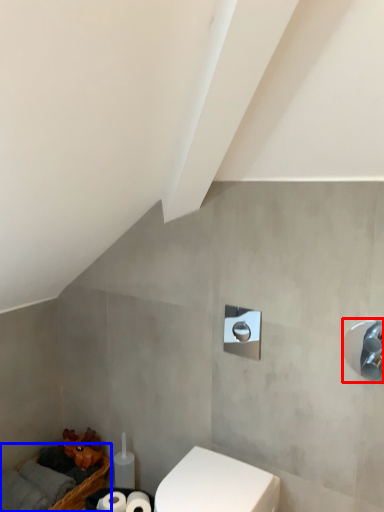
Question: Which point is closer to the camera, shower (highlighted by a red box) or basket (highlighted by a blue box)?

Choices:
 (A) shower
 (B) basket

Answer: (A)